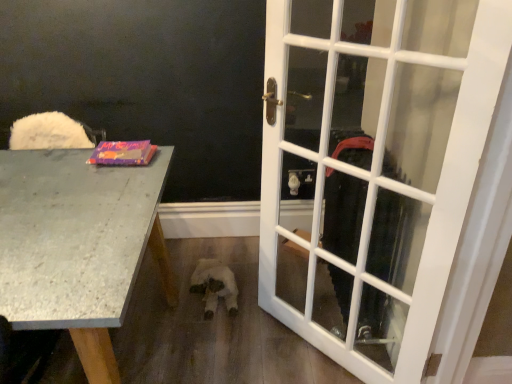
Question: In the image, is matte purple book at left positioned in front of or behind white plush toy at center?

Choices:
 (A) front
 (B) behind

Answer: (A)

Question: Is matte purple book at left wider or thinner than white plush toy at center?

Choices:
 (A) wide
 (B) thin

Answer: (B)

Question: Which object is the farthest from the matte purple book at left?

Choices:
 (A) white plush toy at center
 (B) white glass door at right
 (C) granite gray desk at left

Answer: (B)

Question: Estimate the real-world distances between objects in this image. Which object is farther from the granite gray desk at left?

Choices:
 (A) white glass door at right
 (B) white plush toy at center
 (C) matte purple book at left

Answer: (B)